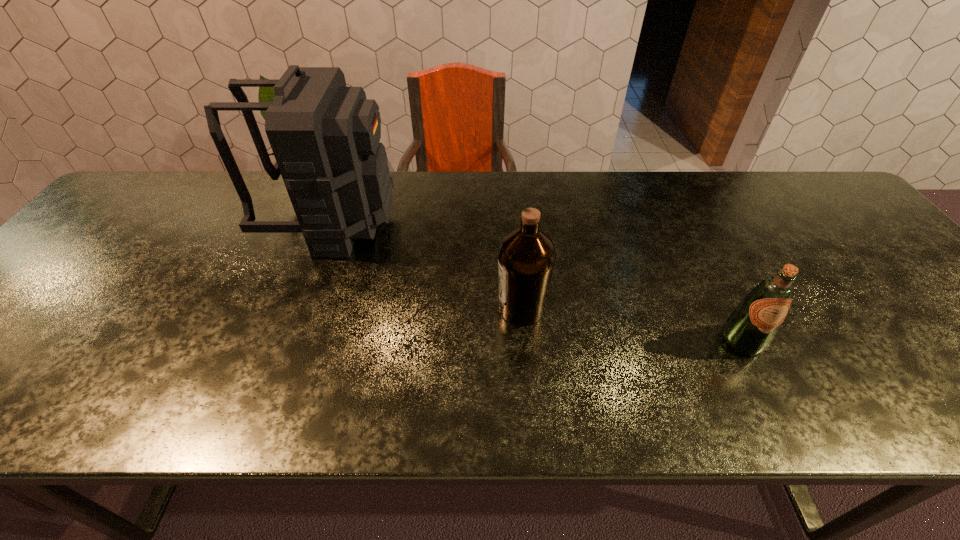
I want to click on the leftmost object, so click(x=325, y=136).

Locate an element on the screen. The width and height of the screenshot is (960, 540). backpack is located at coordinates (325, 136).

You are a GUI agent. You are given a task and a screenshot of the screen. Output one action in this format:
    pyautogui.click(x=<x>, y=<y>)
    Task: Click on the taller olive oil
    
    Given the screenshot: What is the action you would take?
    pyautogui.click(x=526, y=258)

Where is `the second shortest object`? the second shortest object is located at coordinates (526, 258).

Where is `the shorter olive oil`? the shorter olive oil is located at coordinates (749, 330).

Identify the location of the right olive oil. This screenshot has height=540, width=960. (749, 330).

Where is `vacant area located 0.170m on the front compartment of the backpack`? The width and height of the screenshot is (960, 540). vacant area located 0.170m on the front compartment of the backpack is located at coordinates (455, 222).

Identify the location of free spot located on the label of the left olive oil. (439, 309).

This screenshot has height=540, width=960. Identify the location of vacant position located on the label of the left olive oil. (399, 309).

Where is `free space located on the label of the left olive oil`? free space located on the label of the left olive oil is located at coordinates (399, 309).